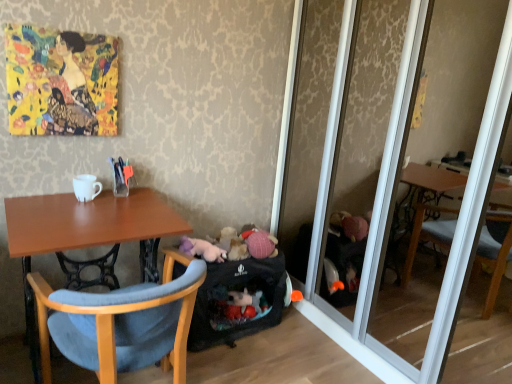
Question: In terms of height, does gold textured painting at upper left look taller or shorter compared to fluffy white stuffed animal at lower center?

Choices:
 (A) tall
 (B) short

Answer: (A)

Question: From a real-world perspective, relative to fluffy white stuffed animal at lower center, is gold textured painting at upper left vertically above or below?

Choices:
 (A) above
 (B) below

Answer: (A)

Question: Which object is the farthest from the gold textured painting at upper left?

Choices:
 (A) white glossy mug at upper left
 (B) fluffy white stuffed animal at lower center
 (C) transparent glass mirror at center
 (D) fluffy plush toys at center
 (E) light blue fabric chair at lower left

Answer: (C)

Question: Which object is positioned closest to the transparent glass mirror at center?

Choices:
 (A) white glossy mug at upper left
 (B) black fabric baby carriage at lower center
 (C) fluffy plush toys at center
 (D) light blue fabric chair at lower left
 (E) gold textured painting at upper left

Answer: (B)